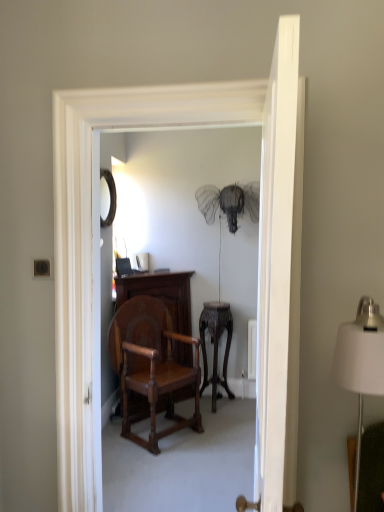
Question: Does matte black mirror at upper left appear on the left side of polished wood vanity at center?

Choices:
 (A) yes
 (B) no

Answer: (A)

Question: From a real-world perspective, does matte black mirror at upper left stand above polished wood vanity at center?

Choices:
 (A) yes
 (B) no

Answer: (A)

Question: Is matte black mirror at upper left touching polished wood vanity at center?

Choices:
 (A) no
 (B) yes

Answer: (A)

Question: From the image's perspective, would you say matte black mirror at upper left is shown under polished wood vanity at center?

Choices:
 (A) yes
 (B) no

Answer: (B)

Question: Can you confirm if matte black mirror at upper left is thinner than polished wood vanity at center?

Choices:
 (A) yes
 (B) no

Answer: (A)

Question: Looking at the image, does dark wood side table at center seem bigger or smaller compared to polished wood vanity at center?

Choices:
 (A) big
 (B) small

Answer: (B)

Question: Does point (231, 329) appear closer or farther from the camera than point (178, 346)?

Choices:
 (A) farther
 (B) closer

Answer: (A)

Question: From their relative heights in the image, would you say dark wood side table at center is taller or shorter than polished wood vanity at center?

Choices:
 (A) tall
 (B) short

Answer: (B)

Question: Is dark wood side table at center in front of or behind polished wood vanity at center in the image?

Choices:
 (A) behind
 (B) front

Answer: (A)

Question: From the image's perspective, relative to white fabric lampshade at right, is dark wood side table at center above or below?

Choices:
 (A) below
 (B) above

Answer: (A)

Question: Considering the positions of dark wood side table at center and white fabric lampshade at right in the image, is dark wood side table at center wider or thinner than white fabric lampshade at right?

Choices:
 (A) thin
 (B) wide

Answer: (B)

Question: In the image, is dark wood side table at center positioned in front of or behind white fabric lampshade at right?

Choices:
 (A) behind
 (B) front

Answer: (A)

Question: Do you think dark wood side table at center is within white fabric lampshade at right, or outside of it?

Choices:
 (A) inside
 (B) outside

Answer: (B)

Question: Is point (120, 394) positioned closer to the camera than point (276, 129)?

Choices:
 (A) closer
 (B) farther

Answer: (B)

Question: Is polished wood chair at center wider or thinner than white smooth door at center?

Choices:
 (A) wide
 (B) thin

Answer: (A)